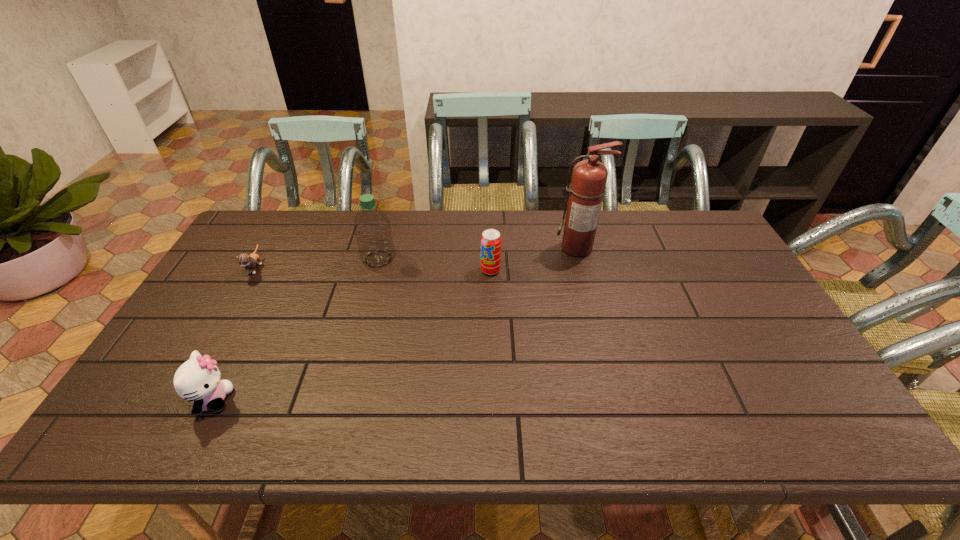
This screenshot has width=960, height=540. What are the coordinates of `free location located 0.130m on the left of the water bottle` in the screenshot? It's located at (321, 259).

Locate an element on the screen. vacant space located 0.050m on the back of the soda can is located at coordinates (490, 254).

I want to click on vacant space located 0.230m on the front-facing side of the right kitten, so click(x=329, y=400).

In order to click on free region located 0.260m on the front-facing side of the farther kitten in this screenshot , I will do pos(209,348).

Where is `fire extinguisher at the far edge`? The image size is (960, 540). fire extinguisher at the far edge is located at coordinates (589, 177).

You are a GUI agent. You are given a task and a screenshot of the screen. Output one action in this format:
    pyautogui.click(x=<x>, y=<y>)
    Task: Click on the water bottle located at the far edge
    
    Given the screenshot: What is the action you would take?
    pyautogui.click(x=372, y=229)

Identify the location of object located in the near edge section of the desktop. This screenshot has width=960, height=540. (198, 380).

Find the location of a particular element. Image resolution: width=960 pixels, height=540 pixels. object that is positioned at the near left corner is located at coordinates (198, 380).

At what (x,y) coordinates should I click in order to perform the action: click on free space at the far edge of the desktop. Please return your answer as a coordinate pair (x, y). This screenshot has height=540, width=960. Looking at the image, I should click on (546, 212).

Locate an element on the screen. Image resolution: width=960 pixels, height=540 pixels. vacant area at the near edge is located at coordinates [374, 437].